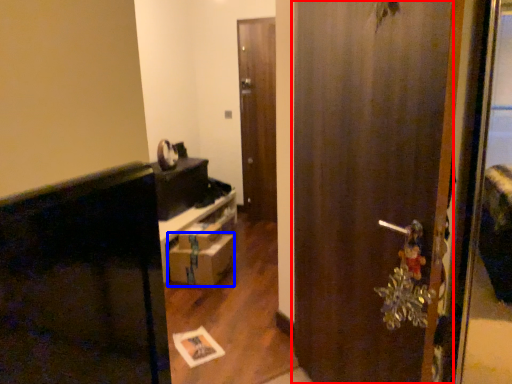
Question: Which of the following is the farthest to the observer, door (highlighted by a red box) or drawer (highlighted by a blue box)?

Choices:
 (A) door
 (B) drawer

Answer: (B)